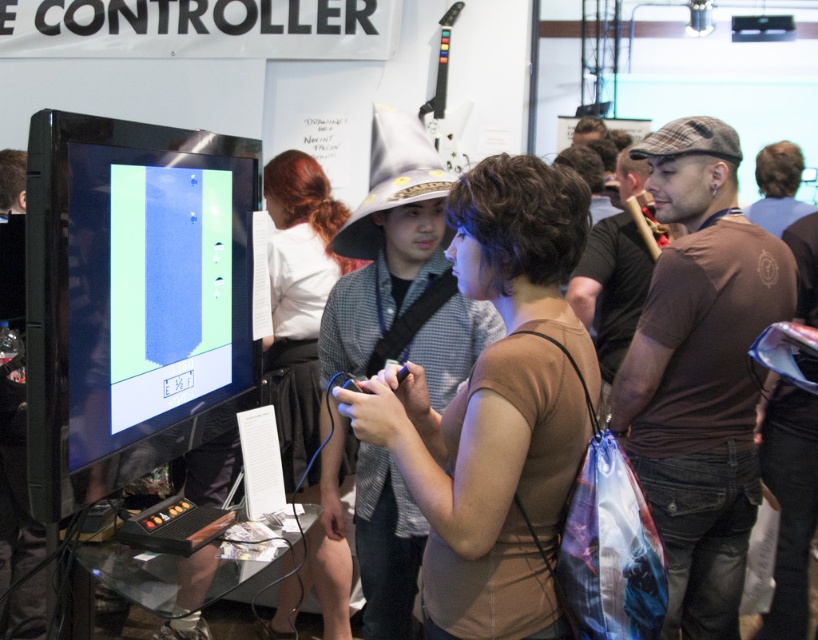
Question: Which point is closer to the camera?

Choices:
 (A) (637, 252)
 (B) (504, 608)
 (C) (664, 188)

Answer: (B)

Question: Can you confirm if shiny black monitor at left is wider than white matte shirt at center?

Choices:
 (A) no
 (B) yes

Answer: (A)

Question: Estimate the real-world distances between objects in this image. Which object is farther from the shiny black monitor at left?

Choices:
 (A) brown cotton t-shirt at center-right
 (B) brown cotton shirt at right
 (C) brown matte shirt at center
 (D) white matte shirt at center

Answer: (B)

Question: Is shiny black monitor at left thinner than brown cotton shirt at right?

Choices:
 (A) no
 (B) yes

Answer: (B)

Question: Can you confirm if brown matte shirt at center is smaller than brown cotton t-shirt at center-right?

Choices:
 (A) no
 (B) yes

Answer: (B)

Question: Which object is the closest to the white matte shirt at center?

Choices:
 (A) brown cotton shirt at right
 (B) brown matte shirt at center
 (C) shiny black monitor at left

Answer: (C)